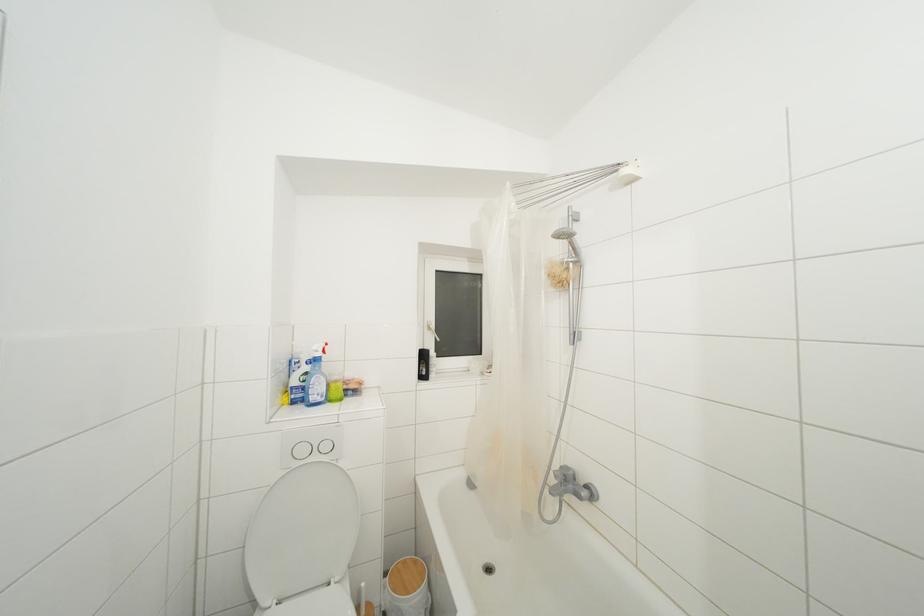
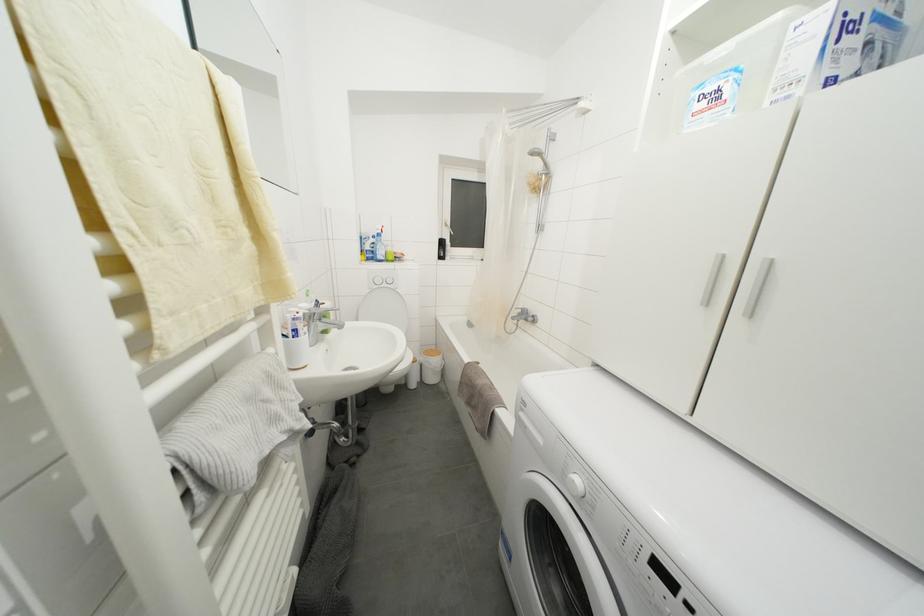
Question: The first image is from the beginning of the video and the second image is from the end. How did the camera likely rotate when shooting the video?

Choices:
 (A) Left
 (B) Right
 (C) Up
 (D) Down

Answer: (D)